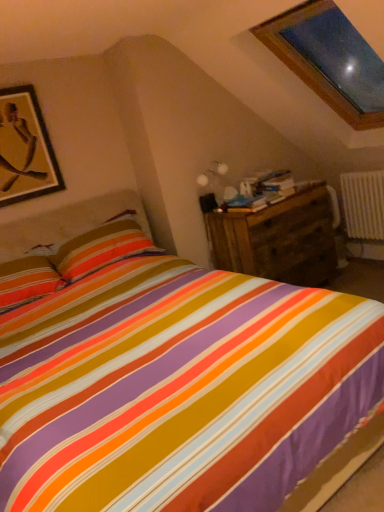
Question: Can you confirm if white plastic radiator at right is thinner than gold matte picture frame at upper left?

Choices:
 (A) no
 (B) yes

Answer: (A)

Question: Would you say white plastic radiator at right is outside gold matte picture frame at upper left?

Choices:
 (A) no
 (B) yes

Answer: (B)

Question: From a real-world perspective, is white plastic radiator at right beneath gold matte picture frame at upper left?

Choices:
 (A) no
 (B) yes

Answer: (B)

Question: From the image's perspective, does white plastic radiator at right appear lower than gold matte picture frame at upper left?

Choices:
 (A) no
 (B) yes

Answer: (B)

Question: Is gold matte picture frame at upper left at the back of white plastic radiator at right?

Choices:
 (A) no
 (B) yes

Answer: (A)

Question: Does white plastic radiator at right have a greater width compared to gold matte picture frame at upper left?

Choices:
 (A) no
 (B) yes

Answer: (B)

Question: Is gold matte picture frame at upper left bigger than wooden chest of drawers at right?

Choices:
 (A) no
 (B) yes

Answer: (A)

Question: From the image's perspective, is gold matte picture frame at upper left located above wooden chest of drawers at right?

Choices:
 (A) yes
 (B) no

Answer: (A)

Question: Can you confirm if gold matte picture frame at upper left is wider than wooden chest of drawers at right?

Choices:
 (A) no
 (B) yes

Answer: (A)

Question: Is gold matte picture frame at upper left at the left side of wooden chest of drawers at right?

Choices:
 (A) yes
 (B) no

Answer: (A)

Question: From a real-world perspective, does gold matte picture frame at upper left sit lower than wooden chest of drawers at right?

Choices:
 (A) no
 (B) yes

Answer: (A)

Question: Does gold matte picture frame at upper left lie in front of wooden chest of drawers at right?

Choices:
 (A) yes
 (B) no

Answer: (A)

Question: Is wooden chest of drawers at right looking in the opposite direction of gold matte picture frame at upper left?

Choices:
 (A) yes
 (B) no

Answer: (B)